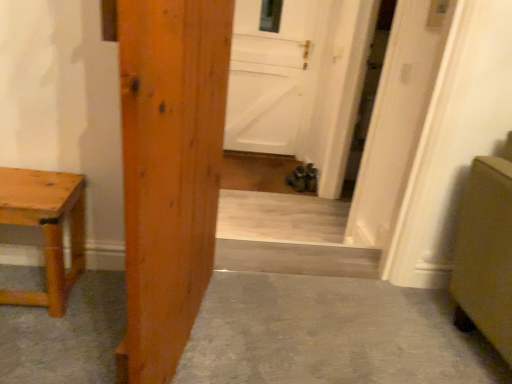
Identify the location of vacant space to the right of wooden door at center, acting as the first door starting from the left. (294, 332).